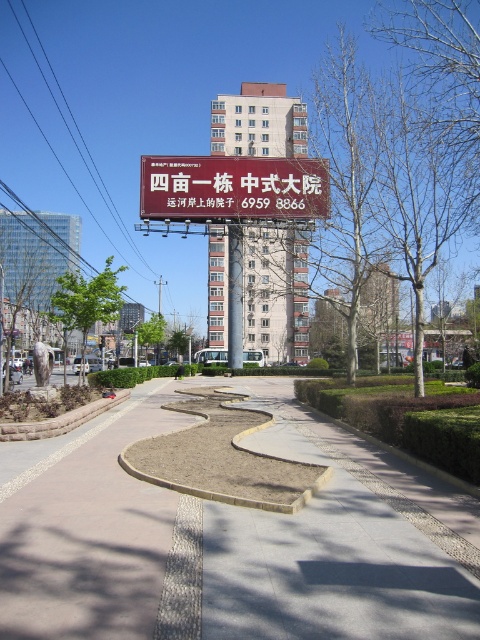
In the scene shown: Can you confirm if matte red sign at center is shorter than metallic sign at center?

Yes.

Can you confirm if matte red sign at center is positioned to the left of metallic sign at center?

Yes, matte red sign at center is to the left of metallic sign at center.

Find the location of a particular element. The image size is (480, 640). matte red sign at center is located at coordinates (232, 188).

Does gray concrete pavement at center have a greater height compared to matte red sign at center?

No, gray concrete pavement at center is not taller than matte red sign at center.

Is point (288, 400) in front of point (176, 163)?

Yes, point (288, 400) is in front of point (176, 163).

I want to click on gray concrete pavement at center, so click(x=228, y=538).

Looking at this image, can you confirm if gray concrete pavement at center is positioned to the left of metallic sign at center?

No, gray concrete pavement at center is not to the left of metallic sign at center.

Who is positioned more to the left, gray concrete pavement at center or metallic sign at center?

From the viewer's perspective, metallic sign at center appears more on the left side.

Between point (301, 516) and point (239, 294), which one is positioned behind?

The point (239, 294) is more distant.

You are a GUI agent. You are given a task and a screenshot of the screen. Output one action in this format:
    pyautogui.click(x=<x>, y=<y>)
    Task: Click on the gray concrete pavement at center
    Image resolution: width=480 pixels, height=640 pixels.
    Given the screenshot: What is the action you would take?
    pyautogui.click(x=228, y=538)